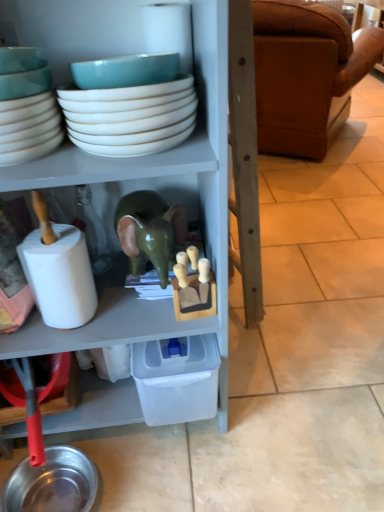
I want to click on vacant area that is situated to the right of metallic silver bowl at lower left, so 146,478.